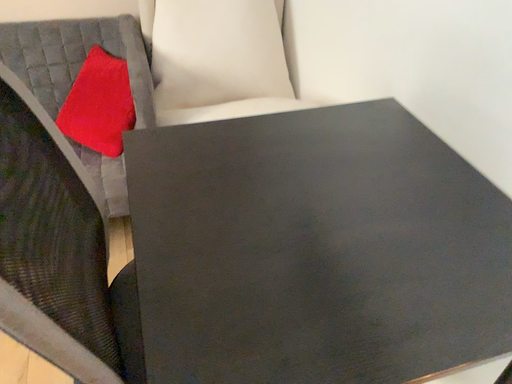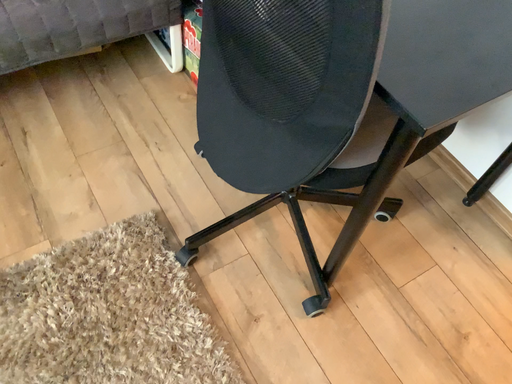
Question: Which way did the camera rotate in the video?

Choices:
 (A) rotated downward
 (B) rotated upward

Answer: (A)